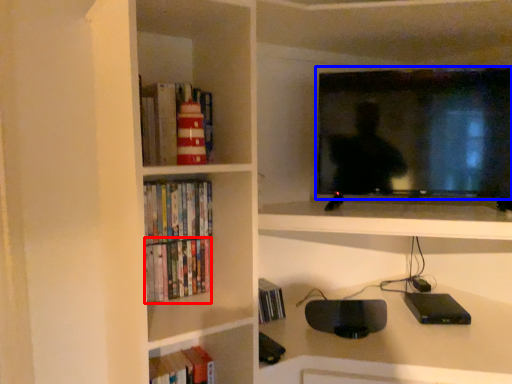
Question: Which object appears closest to the camera in this image, book (highlighted by a red box) or television (highlighted by a blue box)?

Choices:
 (A) book
 (B) television

Answer: (B)